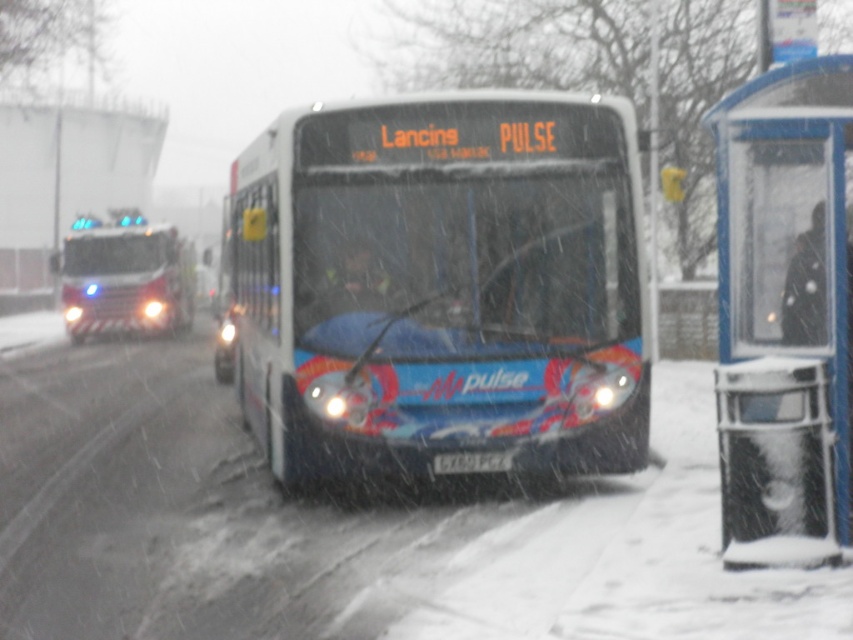
Question: Which point appears closest to the camera in this image?

Choices:
 (A) (851, 186)
 (B) (155, 244)

Answer: (A)

Question: Which object appears closest to the camera in this image?

Choices:
 (A) red firetruck at left
 (B) blue plastic bus stop at right

Answer: (B)

Question: Is blue glossy bus at center thinner than red firetruck at left?

Choices:
 (A) no
 (B) yes

Answer: (A)

Question: Is blue glossy bus at center positioned at the back of blue plastic bus stop at right?

Choices:
 (A) no
 (B) yes

Answer: (B)

Question: Among these objects, which one is farthest from the camera?

Choices:
 (A) blue plastic bus stop at right
 (B) blue glossy bus at center

Answer: (B)

Question: Does blue plastic bus stop at right have a smaller size compared to red firetruck at left?

Choices:
 (A) no
 (B) yes

Answer: (A)